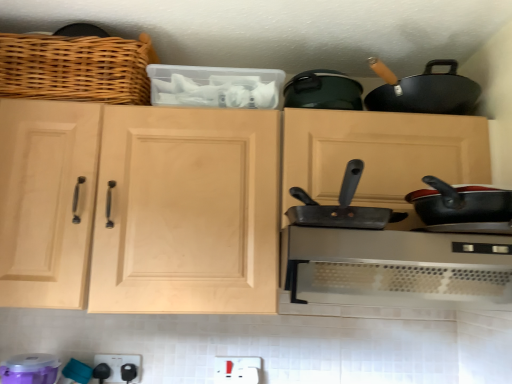
The width and height of the screenshot is (512, 384). In order to click on black plastic outlet at lower center, the 2th appliance when ordered from front to back in this screenshot , I will do `click(119, 365)`.

This screenshot has width=512, height=384. What do you see at coordinates (341, 207) in the screenshot?
I see `metallic gray frying pan at center` at bounding box center [341, 207].

You are a GUI agent. You are given a task and a screenshot of the screen. Output one action in this format:
    pyautogui.click(x=<x>, y=<y>)
    Task: Click on the woven wood basket at upper left
    The height and width of the screenshot is (384, 512).
    Given the screenshot: What is the action you would take?
    pyautogui.click(x=76, y=68)

Is black plastic outlet at lower center, the 2th appliance when ordered from front to back, positioned before natural wood cabinet at center?

No, it is behind natural wood cabinet at center.

Is black plastic outlet at lower center, which is counted as the 1th appliance, starting from the back, facing towards natural wood cabinet at center?

No, black plastic outlet at lower center, which is counted as the 1th appliance, starting from the back, does not turn towards natural wood cabinet at center.

Does point (114, 377) come in front of point (205, 298)?

No, (114, 377) is behind (205, 298).

From a real-world perspective, is black plastic outlet at lower center, which is counted as the 1th appliance, starting from the back, on top of natural wood cabinet at center?

No, from a real-world perspective, black plastic outlet at lower center, which is counted as the 1th appliance, starting from the back, is not over natural wood cabinet at center

From a real-world perspective, is purple plastic container at lower left, which is the 2th appliance in right-to-left order, on top of black plastic outlet at lower center, arranged as the first appliance when viewed from the right?

Yes.

From their relative heights in the image, would you say purple plastic container at lower left, the first appliance viewed from the front, is taller or shorter than black plastic outlet at lower center, the 2th appliance when ordered from front to back?

In the image, purple plastic container at lower left, the first appliance viewed from the front, appears to be taller than black plastic outlet at lower center, the 2th appliance when ordered from front to back.

Looking at this image, is purple plastic container at lower left, the first appliance viewed from the front, to the left of black plastic outlet at lower center, which is counted as the 1th appliance, starting from the back, from the viewer's perspective?

Yes, purple plastic container at lower left, the first appliance viewed from the front, is to the left of black plastic outlet at lower center, which is counted as the 1th appliance, starting from the back.

Where is `appliance lying behind the purple plastic container at lower left, which appears as the 2th appliance when viewed from the back`? appliance lying behind the purple plastic container at lower left, which appears as the 2th appliance when viewed from the back is located at coordinates (119, 365).

Identify the location of cabinetry to the left of metallic gray frying pan at center. (139, 208).

Is natural wood cabinet at center at the right side of metallic gray frying pan at center?

No, natural wood cabinet at center is not to the right of metallic gray frying pan at center.

From a real-world perspective, which is physically above, natural wood cabinet at center or metallic gray frying pan at center?

natural wood cabinet at center is physically above.

Is point (150, 289) closer or farther from the camera than point (306, 209)?

Clearly, point (150, 289) is more distant from the camera than point (306, 209).

Could you tell me if woven wood basket at upper left is facing satin silver range hood at center?

No, woven wood basket at upper left is not oriented towards satin silver range hood at center.

Which of these two, woven wood basket at upper left or satin silver range hood at center, is smaller?

woven wood basket at upper left.

Can you confirm if woven wood basket at upper left is wider than satin silver range hood at center?

Incorrect, the width of woven wood basket at upper left does not surpass that of satin silver range hood at center.

From the image's perspective, between woven wood basket at upper left and satin silver range hood at center, which one is located above?

From the image's view, woven wood basket at upper left is above.

From the image's perspective, which is below, satin silver range hood at center or black plastic outlet at lower center, arranged as the 2th appliance when viewed from the left?

black plastic outlet at lower center, arranged as the 2th appliance when viewed from the left, from the image's perspective.

Who is smaller, satin silver range hood at center or black plastic outlet at lower center, the 2th appliance when ordered from front to back?

black plastic outlet at lower center, the 2th appliance when ordered from front to back, is smaller.

Are satin silver range hood at center and black plastic outlet at lower center, the 2th appliance when ordered from front to back, beside each other?

No, satin silver range hood at center is not in contact with black plastic outlet at lower center, the 2th appliance when ordered from front to back.

From a real-world perspective, which object stands above the other?

satin silver range hood at center, from a real-world perspective.

Is natural wood cabinet at center at the right side of black plastic outlet at lower center, the 2th appliance when ordered from front to back?

Correct, you'll find natural wood cabinet at center to the right of black plastic outlet at lower center, the 2th appliance when ordered from front to back.

Is natural wood cabinet at center in front of black plastic outlet at lower center, arranged as the 2th appliance when viewed from the left?

That is True.

This screenshot has height=384, width=512. I want to click on the 1st appliance to the left of the natural wood cabinet at center, counting from the anchor's position, so click(119, 365).

From the image's perspective, which is above, natural wood cabinet at center or black plastic outlet at lower center, which is counted as the 1th appliance, starting from the back?

natural wood cabinet at center, from the image's perspective.

Which object is thinner, black plastic outlet at lower center, the 2th appliance when ordered from front to back, or purple plastic container at lower left, which is the 2th appliance in right-to-left order?

With smaller width is black plastic outlet at lower center, the 2th appliance when ordered from front to back.

Considering the relative positions of black plastic outlet at lower center, arranged as the 2th appliance when viewed from the left, and purple plastic container at lower left, marked as the first appliance in a left-to-right arrangement, in the image provided, is black plastic outlet at lower center, arranged as the 2th appliance when viewed from the left, to the right of purple plastic container at lower left, marked as the first appliance in a left-to-right arrangement, from the viewer's perspective?

Indeed, black plastic outlet at lower center, arranged as the 2th appliance when viewed from the left, is positioned on the right side of purple plastic container at lower left, marked as the first appliance in a left-to-right arrangement.

From the image's perspective, is black plastic outlet at lower center, arranged as the first appliance when viewed from the right, located beneath purple plastic container at lower left, which appears as the 2th appliance when viewed from the back?

Yes, from the image's perspective, black plastic outlet at lower center, arranged as the first appliance when viewed from the right, is below purple plastic container at lower left, which appears as the 2th appliance when viewed from the back.

Considering the sizes of black plastic outlet at lower center, which is counted as the 1th appliance, starting from the back, and purple plastic container at lower left, the first appliance viewed from the front, in the image, is black plastic outlet at lower center, which is counted as the 1th appliance, starting from the back, taller or shorter than purple plastic container at lower left, the first appliance viewed from the front,?

In the image, black plastic outlet at lower center, which is counted as the 1th appliance, starting from the back, appears to be shorter than purple plastic container at lower left, the first appliance viewed from the front.

The image size is (512, 384). Identify the location of cabinetry lying on the right of black plastic outlet at lower center, the 2th appliance when ordered from front to back. point(139,208).

In order to click on appliance that is above the black plastic outlet at lower center, arranged as the 2th appliance when viewed from the left (from the image's perspective) in this screenshot , I will do `click(30, 369)`.

From the picture: When comparing their distances from satin silver range hood at center, does natural wood cabinet at center or woven wood basket at upper left seem closer?

The object closer to satin silver range hood at center is natural wood cabinet at center.

Based on their spatial positions, is metallic gray frying pan at center or black plastic outlet at lower center, the 2th appliance when ordered from front to back, closer to natural wood cabinet at center?

metallic gray frying pan at center lies closer to natural wood cabinet at center than the other object.

Based on their spatial positions, is metallic gray frying pan at center or natural wood cabinet at center further from satin silver range hood at center?

Among the two, natural wood cabinet at center is located further to satin silver range hood at center.

Looking at this image, looking at the image, which one is located further to metallic gray frying pan at center, black plastic outlet at lower center, which is counted as the 1th appliance, starting from the back, or woven wood basket at upper left?

Among the two, black plastic outlet at lower center, which is counted as the 1th appliance, starting from the back, is located further to metallic gray frying pan at center.

Which object lies nearer to the anchor point satin silver range hood at center, black plastic outlet at lower center, the 2th appliance when ordered from front to back, or woven wood basket at upper left?

Based on the image, woven wood basket at upper left appears to be nearer to satin silver range hood at center.

In the scene shown: Based on their spatial positions, is satin silver range hood at center or black plastic outlet at lower center, arranged as the first appliance when viewed from the right, closer to metallic gray frying pan at center?

Among the two, satin silver range hood at center is located nearer to metallic gray frying pan at center.

Looking at the image, which one is located further to purple plastic container at lower left, which is the 2th appliance in right-to-left order, satin silver range hood at center or metallic gray frying pan at center?

The object further to purple plastic container at lower left, which is the 2th appliance in right-to-left order, is satin silver range hood at center.

Considering their positions, is purple plastic container at lower left, the first appliance viewed from the front, positioned closer to satin silver range hood at center than metallic gray frying pan at center?

Based on the image, metallic gray frying pan at center appears to be nearer to satin silver range hood at center.

Where is `appliance located between purple plastic container at lower left, which appears as the 2th appliance when viewed from the back, and metallic gray frying pan at center in the left-right direction`? Image resolution: width=512 pixels, height=384 pixels. appliance located between purple plastic container at lower left, which appears as the 2th appliance when viewed from the back, and metallic gray frying pan at center in the left-right direction is located at coordinates pos(119,365).

This screenshot has width=512, height=384. Find the location of `basket between purple plastic container at lower left, the first appliance viewed from the front, and metallic gray frying pan at center`. basket between purple plastic container at lower left, the first appliance viewed from the front, and metallic gray frying pan at center is located at coordinates (76, 68).

At what (x,y) coordinates should I click in order to perform the action: click on frying pan between natural wood cabinet at center and satin silver range hood at center from left to right. Please return your answer as a coordinate pair (x, y). This screenshot has width=512, height=384. Looking at the image, I should click on (341, 207).

This screenshot has width=512, height=384. Find the location of `cabinetry that lies between woven wood basket at upper left and black plastic outlet at lower center, arranged as the 2th appliance when viewed from the left, from top to bottom`. cabinetry that lies between woven wood basket at upper left and black plastic outlet at lower center, arranged as the 2th appliance when viewed from the left, from top to bottom is located at coordinates (139, 208).